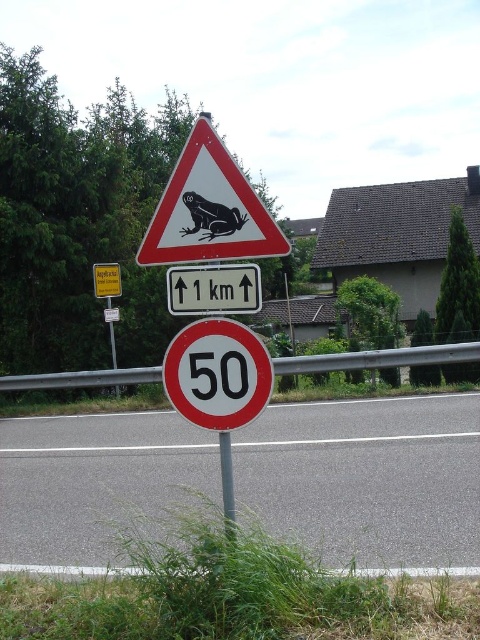
You are a driver approaching a road with two signs ahead. You see the matte plastic frog at upper center and the yellow plastic sign at upper center. Which of these two signs is located higher up?

The yellow plastic sign at upper center is higher up because the matte plastic frog at upper center is positioned under it.

Consider the image. You are driving a car and see the white plastic sign at center and the metallic pole at center along the roadside. Which object is closer to your car?

The white plastic sign at center is closer to your car because it is further to the viewer than the metallic pole at center, meaning it is positioned in front of the pole.